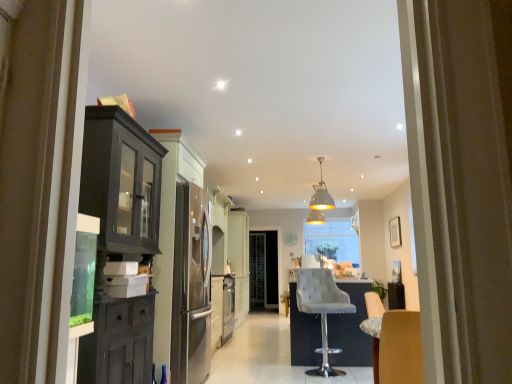
Question: Is point (309, 205) positioned closer to the camera than point (308, 271)?

Choices:
 (A) farther
 (B) closer

Answer: (A)

Question: In terms of height, does white matte pendant light at center look taller or shorter compared to gray fabric bar stool at center?

Choices:
 (A) tall
 (B) short

Answer: (B)

Question: From a real-world perspective, relative to gray fabric bar stool at center, is white matte pendant light at center vertically above or below?

Choices:
 (A) above
 (B) below

Answer: (A)

Question: Considering the positions of gray fabric bar stool at center and white matte pendant light at center in the image, is gray fabric bar stool at center taller or shorter than white matte pendant light at center?

Choices:
 (A) short
 (B) tall

Answer: (B)

Question: Is gray fabric bar stool at center bigger or smaller than white matte pendant light at center?

Choices:
 (A) small
 (B) big

Answer: (B)

Question: In the image, is gray fabric bar stool at center on the left side or the right side of white matte pendant light at center?

Choices:
 (A) right
 (B) left

Answer: (B)

Question: Considering the positions of point (348, 306) and point (324, 183), is point (348, 306) closer or farther from the camera than point (324, 183)?

Choices:
 (A) closer
 (B) farther

Answer: (A)